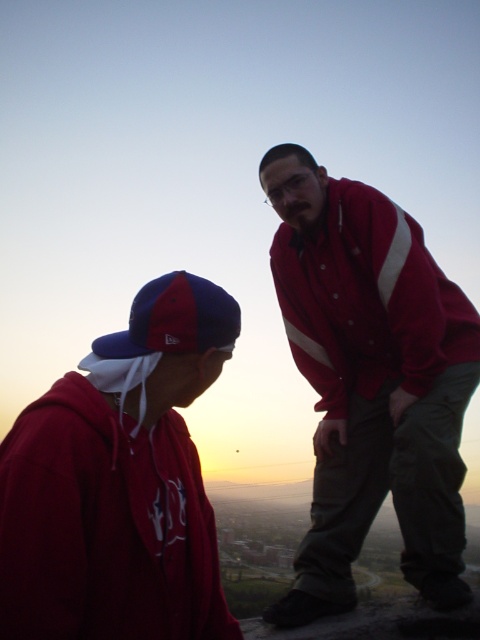
Question: Is red matte jacket at right to the left of blue fabric baseball cap at lower left from the viewer's perspective?

Choices:
 (A) yes
 (B) no

Answer: (B)

Question: Which point is closer to the camera taking this photo?

Choices:
 (A) (381, 422)
 (B) (190, 307)
 (C) (131, 385)

Answer: (C)

Question: Is matte red hoodie at left positioned behind blue fabric baseball cap at lower left?

Choices:
 (A) yes
 (B) no

Answer: (B)

Question: Which object appears closest to the camera in this image?

Choices:
 (A) red matte jacket at right
 (B) matte red hoodie at left

Answer: (B)

Question: Which is nearer to the blue fabric baseball cap at lower left?

Choices:
 (A) matte red hoodie at left
 (B) red matte jacket at right

Answer: (A)

Question: Is red matte jacket at right below matte red hoodie at left?

Choices:
 (A) no
 (B) yes

Answer: (A)